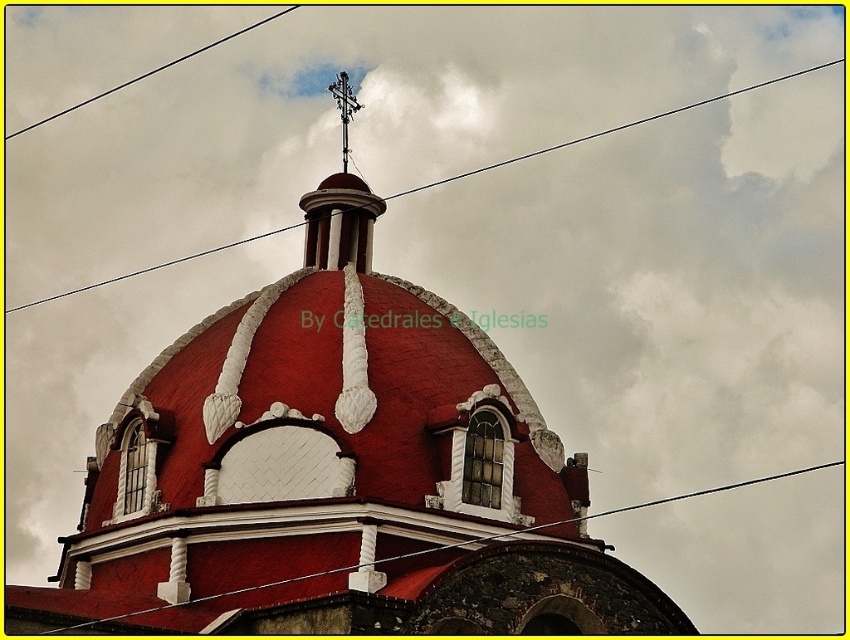
You are an architect inspecting the dome structure. You notice two wires, the metallic wire at upper center and the black wire at upper left. From your vantage point, which wire is positioned to the right of the other?

The metallic wire at upper center is positioned to the right of the black wire at upper left.